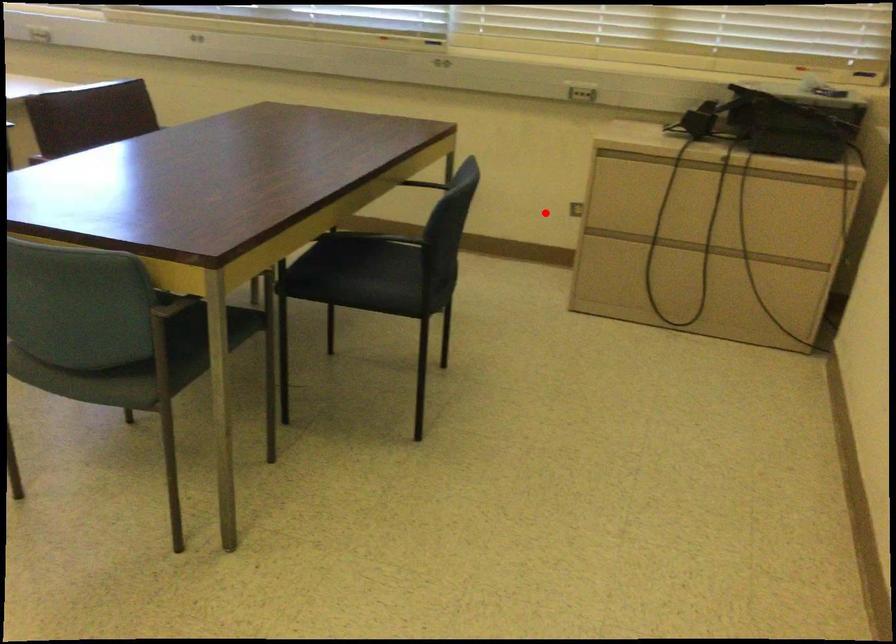
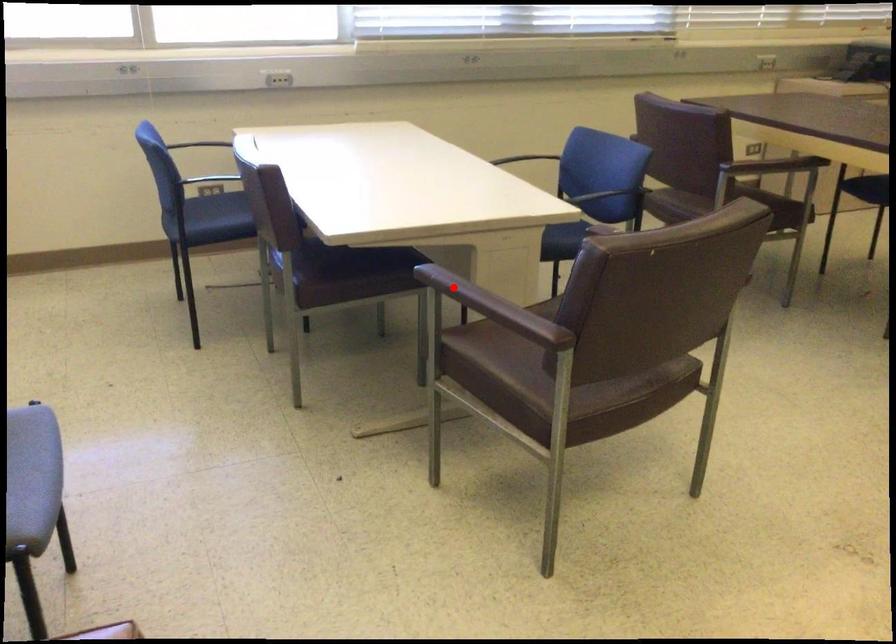
I am providing you with two images of the same scene from different viewpoints. A red point is marked on the first image and another point is marked on the second image. Does the point marked in image1 correspond to the same location as the one in image2?

No